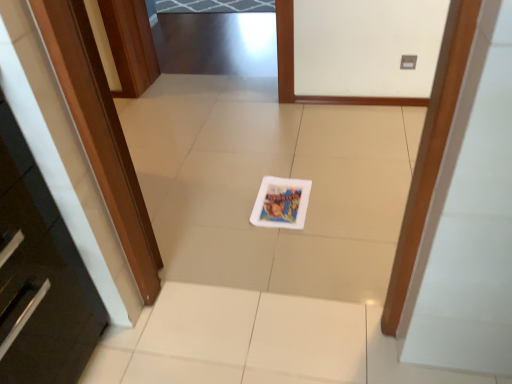
Find the location of a particular element. The width and height of the screenshot is (512, 384). free space to the right of white glossy postcard at center is located at coordinates (342, 196).